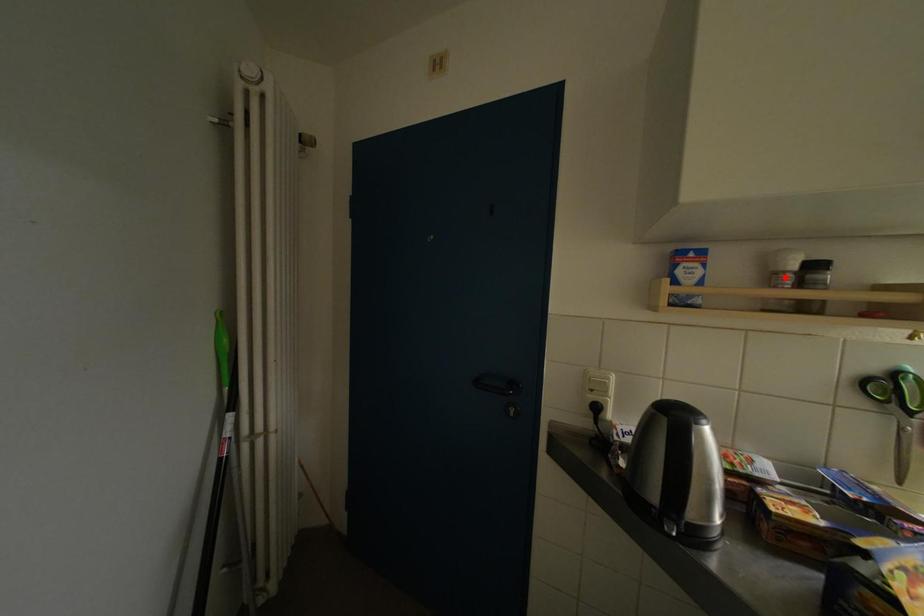
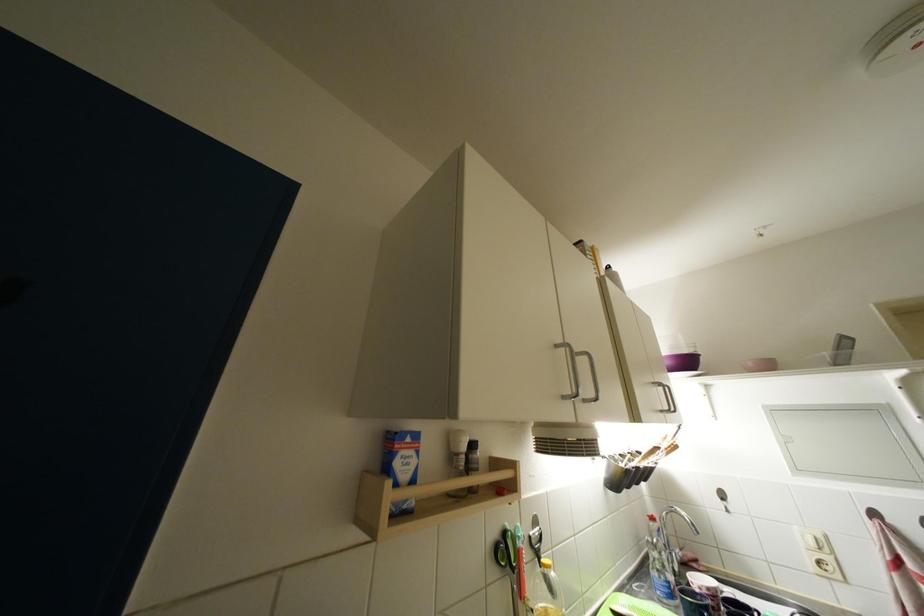
Where in the second image is the point corresponding to the highlighted location from the first image?

(464, 458)